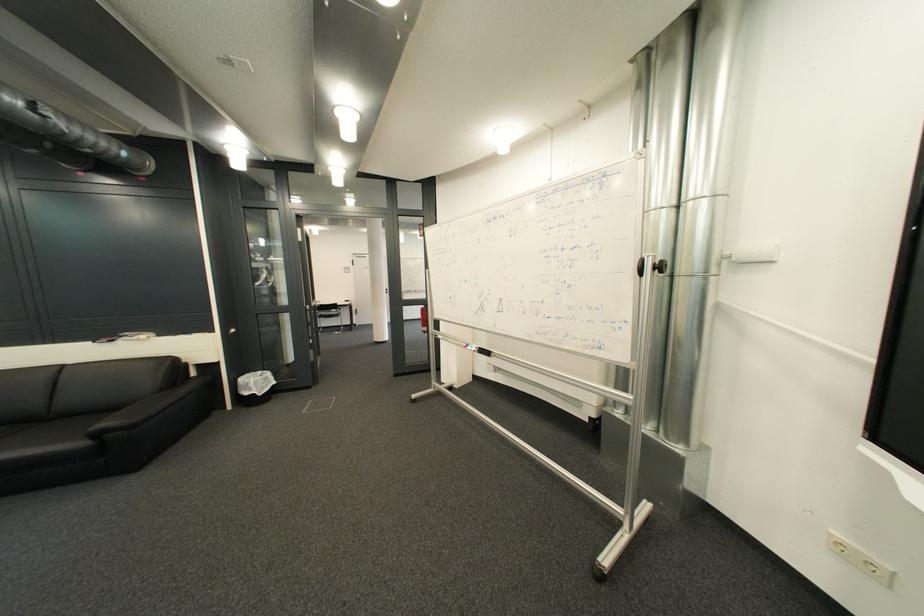
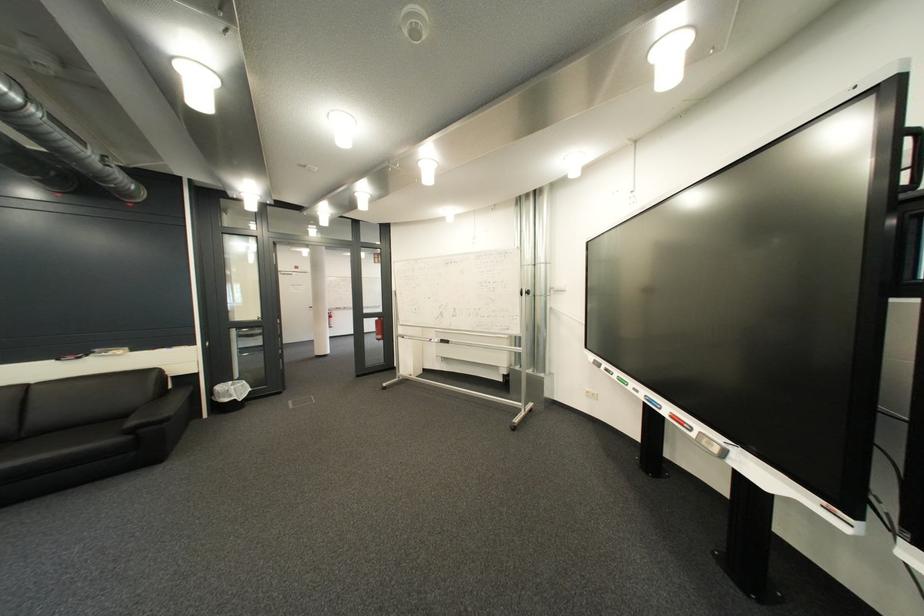
The point at (274, 374) is marked in the first image. Where is the corresponding point in the second image?

(245, 384)